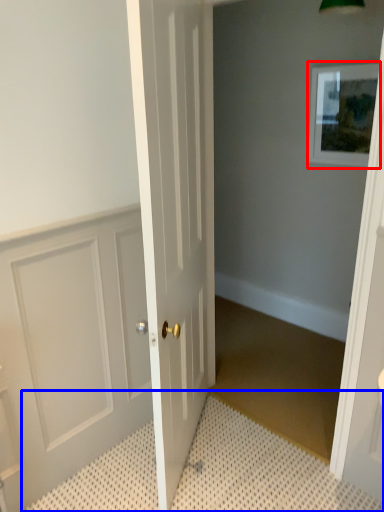
Question: Among these objects, which one is farthest to the camera, picture frame (highlighted by a red box) or bath mat (highlighted by a blue box)?

Choices:
 (A) picture frame
 (B) bath mat

Answer: (A)